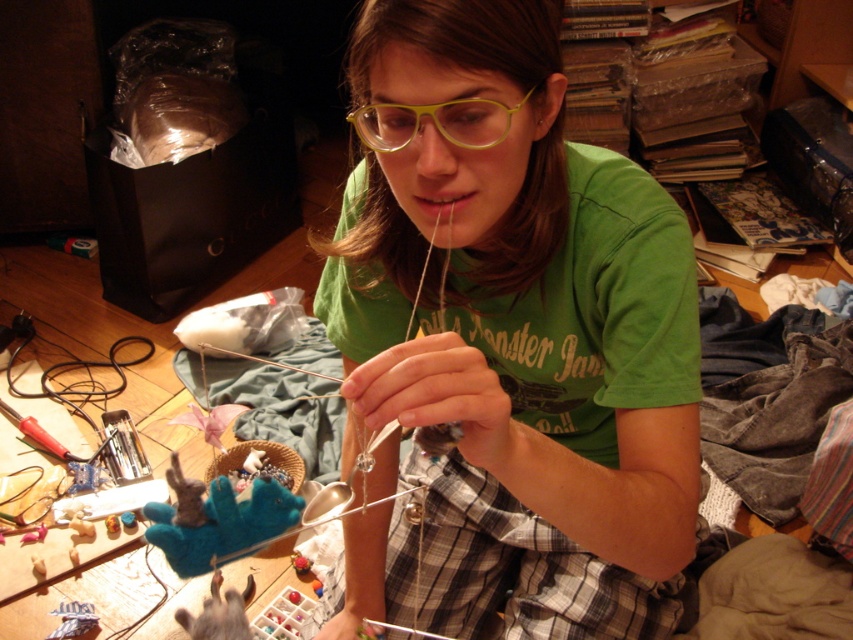
You are a delivery person who needs to place a small package between the yellow plastic glasses at center and the plaid fabric hand at lower center. The package requires at least 20 inches of space. Can you fit it there?

The yellow plastic glasses at center is 26.17 inches away from the plaid fabric hand at lower center, so yes, the package can fit between them as there is enough space.

You are standing in the cluttered workspace and want to pick up an item located at point (405, 380). Is this item closer to you than the item at point (370, 125)?

Point (405, 380) is in front of point (370, 125), so yes, the item at point (405, 380) is closer to you than the item at point (370, 125).